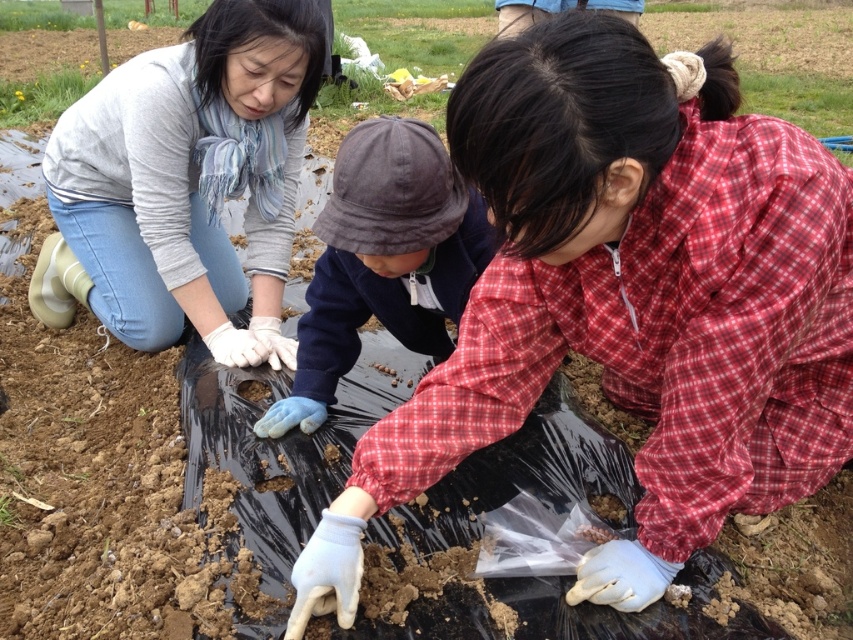
Based on the scene, which object is shorter between the blue cotton hat at center and the black plastic bag at center?

The blue cotton hat at center is shorter than the black plastic bag at center.

Where is the matte gray sweater at upper left located in the image?

The matte gray sweater at upper left is located at the coordinates point (x=184, y=182).